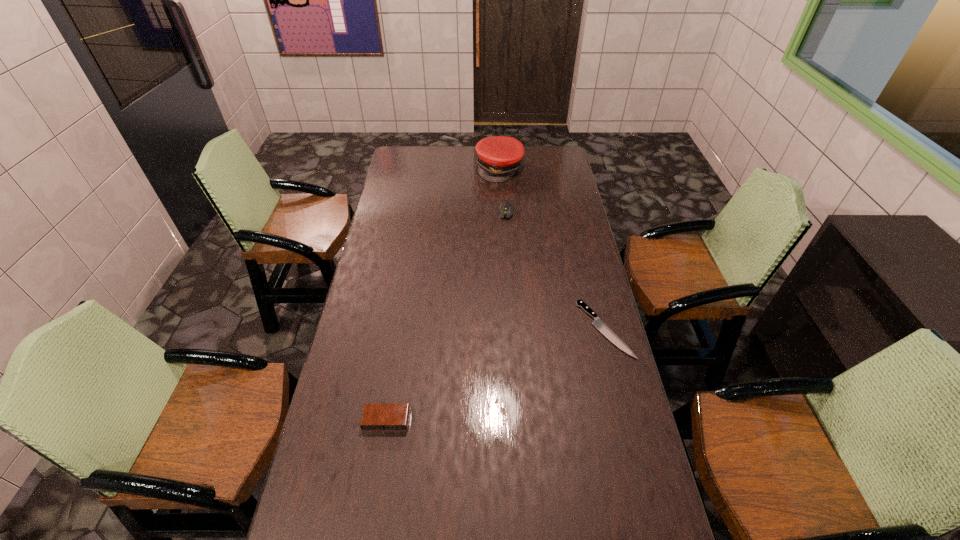
Locate an element on the screen. This screenshot has height=540, width=960. vacant space located on the wheel side of the third nearest object is located at coordinates (504, 233).

You are a GUI agent. You are given a task and a screenshot of the screen. Output one action in this format:
    pyautogui.click(x=<x>, y=<y>)
    Task: Click on the vacant space located 0.300m on the wheel side of the third nearest object
    This screenshot has width=960, height=540.
    Given the screenshot: What is the action you would take?
    pyautogui.click(x=500, y=267)

The image size is (960, 540). I want to click on vacant space located on the wheel side of the third nearest object, so [x=499, y=276].

Where is `vacant space located on the front of the tallest object with an emblem`? vacant space located on the front of the tallest object with an emblem is located at coordinates (503, 190).

The height and width of the screenshot is (540, 960). Identify the location of free spot located on the front of the tallest object with an emblem. (503, 192).

Locate an element on the screen. This screenshot has height=540, width=960. vacant space situated 0.120m on the front of the tallest object with an emblem is located at coordinates (504, 197).

Locate an element on the screen. This screenshot has height=540, width=960. object that is at the far edge is located at coordinates (498, 157).

Find the location of a particular element. The width and height of the screenshot is (960, 540). object that is at the left edge is located at coordinates (376, 417).

The height and width of the screenshot is (540, 960). I want to click on object that is at the right edge, so click(598, 323).

At what (x,y) coordinates should I click in order to perform the action: click on free region at the far edge. Please return your answer as a coordinate pair (x, y). This screenshot has width=960, height=540. Looking at the image, I should click on (457, 162).